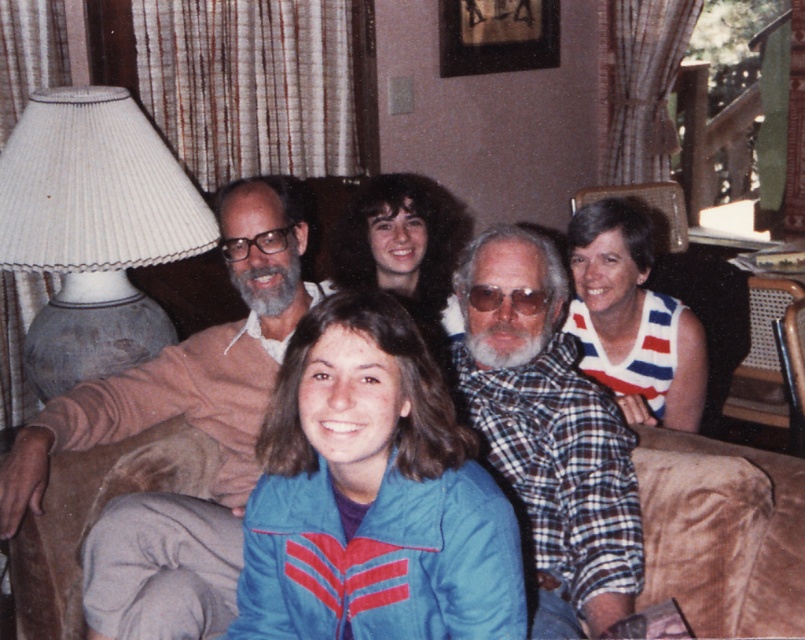
In order to click on dark brown curly hair at center in this screenshot , I will do `click(399, 250)`.

Is dark brown curly hair at center above clear plastic glasses at center?

Indeed, dark brown curly hair at center is positioned over clear plastic glasses at center.

At what (x,y) coordinates should I click in order to perform the action: click on dark brown curly hair at center. Please return your answer as a coordinate pair (x, y). Image resolution: width=805 pixels, height=640 pixels. Looking at the image, I should click on (399, 250).

Is white striped sweater at upper right bigger than matte black glasses at upper center?

Yes.

Which of these two, white striped sweater at upper right or matte black glasses at upper center, stands shorter?

matte black glasses at upper center

Identify the location of white striped sweater at upper right. tap(632, 320).

This screenshot has width=805, height=640. In order to click on white striped sweater at upper right in this screenshot , I will do `click(632, 320)`.

Does light brown sweater at left have a greater height compared to white pleated lampshade at left?

Indeed, light brown sweater at left has a greater height compared to white pleated lampshade at left.

What do you see at coordinates (188, 422) in the screenshot? I see `light brown sweater at left` at bounding box center [188, 422].

Identify the location of light brown sweater at left. (188, 422).